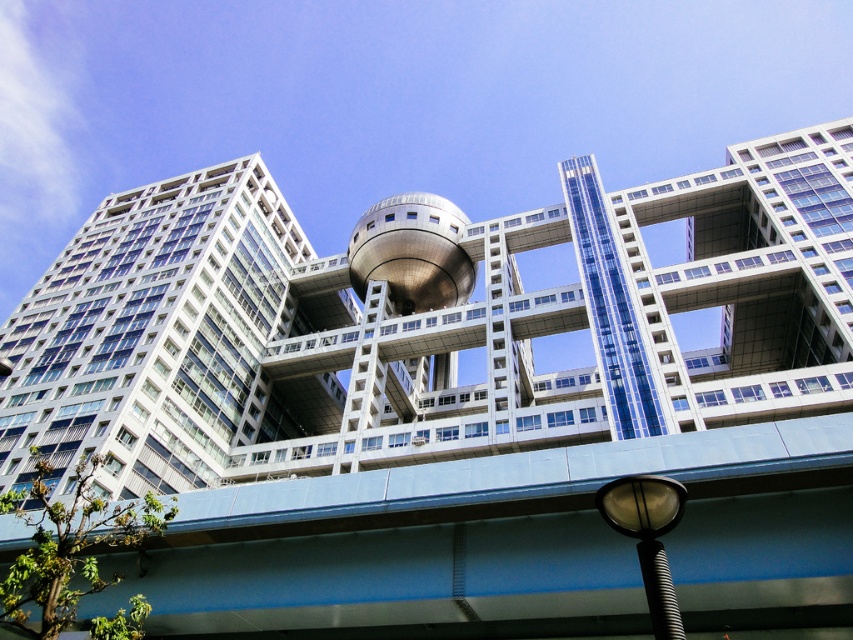
You are an architect reviewing the blueprint of the building. The metallic silver tower at center and the sleek metallic sphere at center are key elements. Which one is located to the right of the other?

The metallic silver tower at center is positioned on the right side of the sleek metallic sphere at center, so the metallic silver tower at center is to the right of the sleek metallic sphere at center.

You are standing at the base of the metallic silver tower at center. You want to walk to the nearest exit, which is located 200 feet away from you. Can you reach the exit without crossing any bridges or walkways?

The metallic silver tower at center is 169.94 feet away from the viewer. Since the exit is 200 feet away from you, you can reach the exit without crossing any bridges or walkways as the distance is within the required range.

You are standing at the entrance of the modern building and see two points marked on the central sphere. The first point is at coordinates point (693, 428) and the second is at point (83, 349). Which point is closer to you when facing the building?

Point (693, 428) is in front of point (83, 349), so it is closer to you when facing the building.